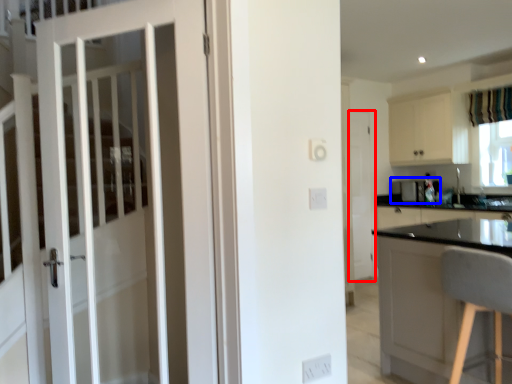
Question: Which object is closer to the camera taking this photo, door (highlighted by a red box) or appliance (highlighted by a blue box)?

Choices:
 (A) door
 (B) appliance

Answer: (B)